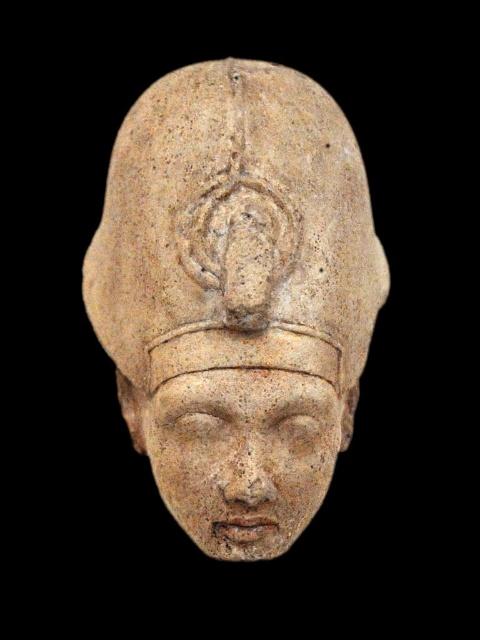
Question: Can you confirm if beige stone head at center is positioned to the left of matte stone face at center?

Choices:
 (A) no
 (B) yes

Answer: (B)

Question: Can you confirm if beige stone head at center is wider than matte stone face at center?

Choices:
 (A) yes
 (B) no

Answer: (A)

Question: Which of the following is the closest to the observer?

Choices:
 (A) beige stone head at center
 (B) matte stone face at center

Answer: (A)

Question: Can you confirm if beige stone head at center is smaller than matte stone face at center?

Choices:
 (A) yes
 (B) no

Answer: (B)

Question: Which of the following is the farthest from the observer?

Choices:
 (A) (370, 292)
 (B) (204, 410)

Answer: (A)